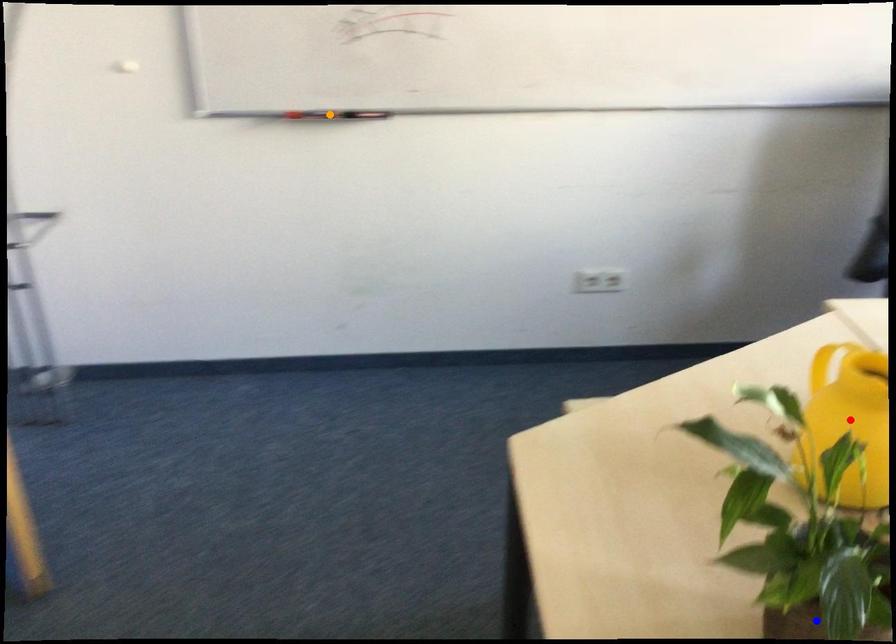
Looking at this image, order these from nearest to farthest:
orange point, red point, blue point

orange point, red point, blue point